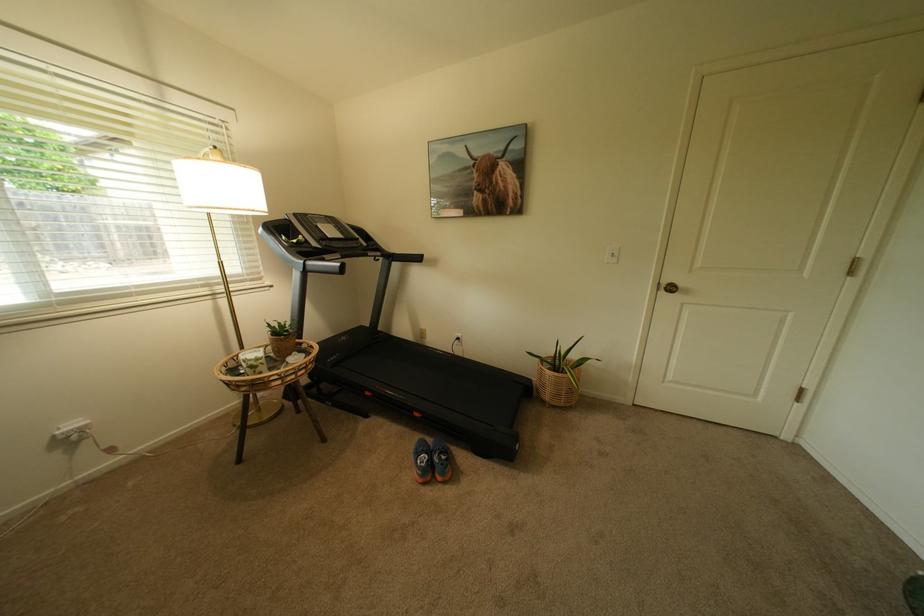
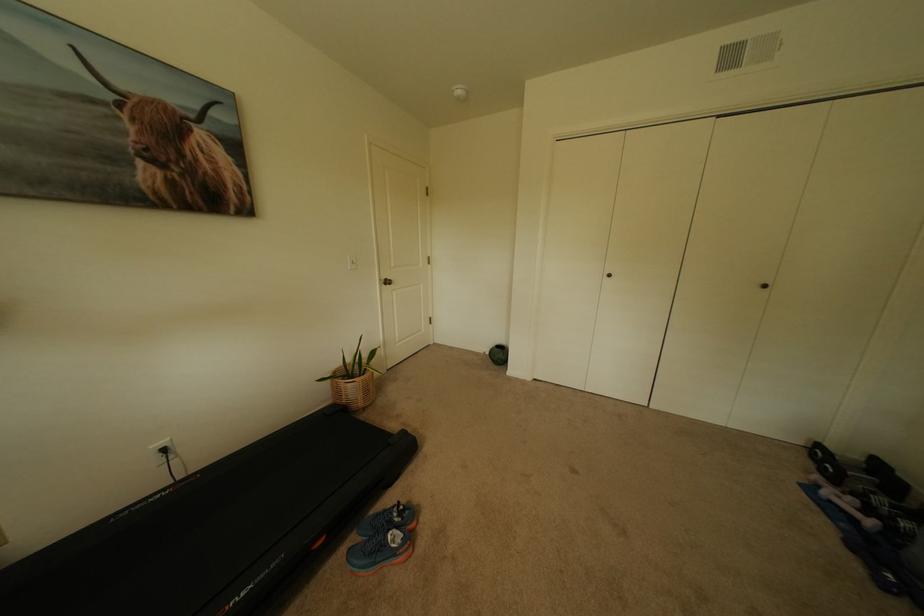
Where in the second image is the point corresponding to (467,339) from the first image?

(173, 451)